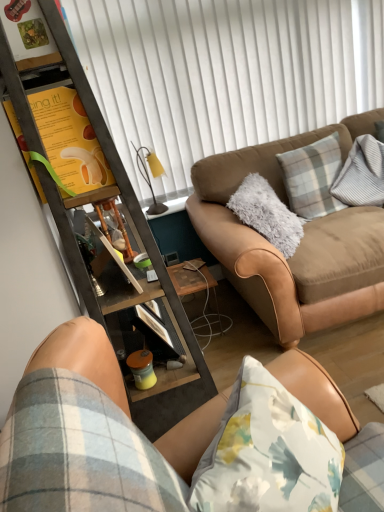
Question: From a real-world perspective, is matte yellow cup at lower center physically above yellow paper at upper left?

Choices:
 (A) yes
 (B) no

Answer: (B)

Question: Can you confirm if matte yellow cup at lower center is positioned to the right of yellow paper at upper left?

Choices:
 (A) no
 (B) yes

Answer: (B)

Question: Is yellow paper at upper left a part of matte yellow cup at lower center?

Choices:
 (A) no
 (B) yes

Answer: (A)

Question: Does matte yellow cup at lower center have a greater width compared to yellow paper at upper left?

Choices:
 (A) yes
 (B) no

Answer: (B)

Question: Is matte yellow cup at lower center closer to the viewer compared to yellow paper at upper left?

Choices:
 (A) yes
 (B) no

Answer: (B)

Question: Considering the positions of point (54, 158) and point (104, 313), is point (54, 158) closer or farther from the camera than point (104, 313)?

Choices:
 (A) farther
 (B) closer

Answer: (B)

Question: Based on their sizes in the image, would you say yellow paper at upper left is bigger or smaller than metallic brown cabinet at left?

Choices:
 (A) big
 (B) small

Answer: (B)

Question: In terms of height, does yellow paper at upper left look taller or shorter compared to metallic brown cabinet at left?

Choices:
 (A) short
 (B) tall

Answer: (A)

Question: From a real-world perspective, is yellow paper at upper left above or below metallic brown cabinet at left?

Choices:
 (A) above
 (B) below

Answer: (A)

Question: Is yellow paper at upper left inside or outside of suede tan couch at lower right, which is the first studio couch from front to back?

Choices:
 (A) outside
 (B) inside

Answer: (A)

Question: Considering the positions of yellow paper at upper left and suede tan couch at lower right, the second studio couch viewed from the back, in the image, is yellow paper at upper left bigger or smaller than suede tan couch at lower right, the second studio couch viewed from the back,?

Choices:
 (A) big
 (B) small

Answer: (B)

Question: Is yellow paper at upper left in front of or behind suede tan couch at lower right, the second studio couch viewed from the back, in the image?

Choices:
 (A) front
 (B) behind

Answer: (B)

Question: From a real-world perspective, is yellow paper at upper left physically located above or below suede tan couch at lower right, the second studio couch viewed from the back?

Choices:
 (A) below
 (B) above

Answer: (B)

Question: From a real-world perspective, is metallic brown cabinet at left physically located above or below suede brown couch at center, which is the second studio couch from front to back?

Choices:
 (A) below
 (B) above

Answer: (B)

Question: In terms of height, does metallic brown cabinet at left look taller or shorter compared to suede brown couch at center, which is the second studio couch from front to back?

Choices:
 (A) short
 (B) tall

Answer: (B)